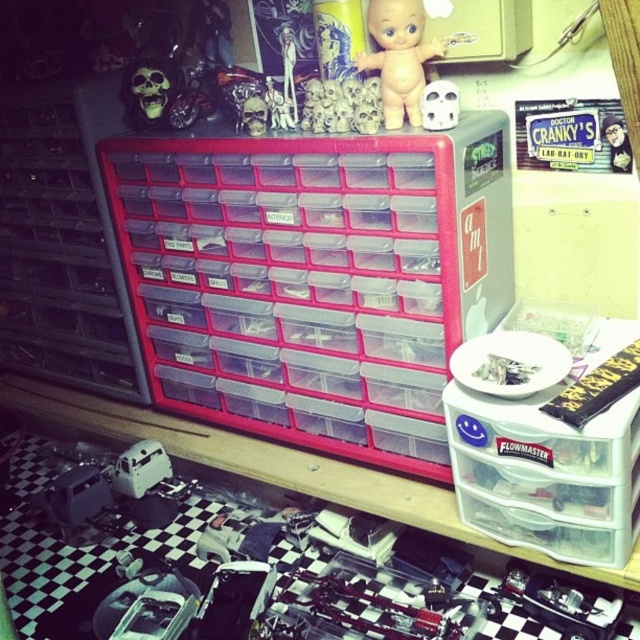
Question: Which point is farther to the camera?

Choices:
 (A) transparent plastic drawer at center
 (B) bare skin doll at upper center

Answer: (B)

Question: Estimate the real-world distances between objects in this image. Which object is closer to the transparent plastic drawer at center?

Choices:
 (A) bare skin doll at upper center
 (B) transparent plastic drawers at center

Answer: (A)

Question: Is the position of transparent plastic drawers at center more distant than that of bare skin doll at upper center?

Choices:
 (A) yes
 (B) no

Answer: (A)

Question: Where is bare skin doll at upper center located in relation to matte plastic skull at center in the image?

Choices:
 (A) below
 (B) above

Answer: (B)

Question: Based on their relative distances, which object is farther from the bare skin doll at upper center?

Choices:
 (A) matte plastic skull at center
 (B) transparent plastic drawer at center
 (C) metallic silver toy at upper right

Answer: (C)

Question: Is transparent plastic drawers at center thinner than metallic silver toy at upper right?

Choices:
 (A) yes
 (B) no

Answer: (B)